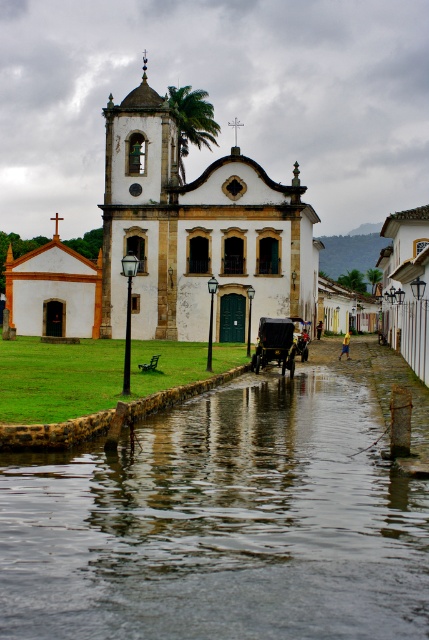
You are standing at the point marked by the coordinates point [220,524]. Looking towards the church, which direction would you face? Please answer with either north, south, east, or west.

Since the point [220,524] represents clear water at lower center, and the church is situated in front of the grassy area with the canal running parallel, facing the church from this point would mean you are facing north.

You are standing in front of the church and notice two green leafy palm trees in the scene. Which one is closer to you, the green leafy palm tree at upper center or the green leafy palm tree at center?

The green leafy palm tree at upper center is closer to you because it is in front of the green leafy palm tree at center.